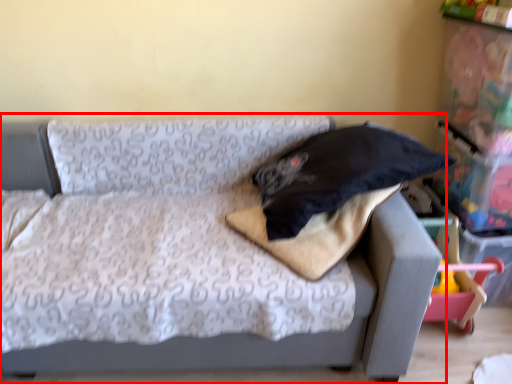
Question: From the image, what is the correct spatial relationship of studio couch (annotated by the red box) in relation to pillow?

Choices:
 (A) right
 (B) left

Answer: (B)